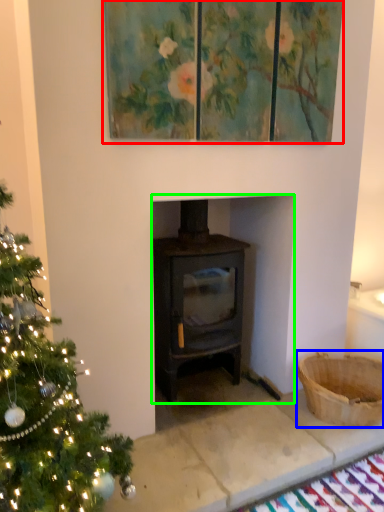
Question: Estimate the real-world distances between objects in this image. Which object is farther from oil painting (highlighted by a red box), basket (highlighted by a blue box) or fireplace (highlighted by a green box)?

Choices:
 (A) basket
 (B) fireplace

Answer: (A)